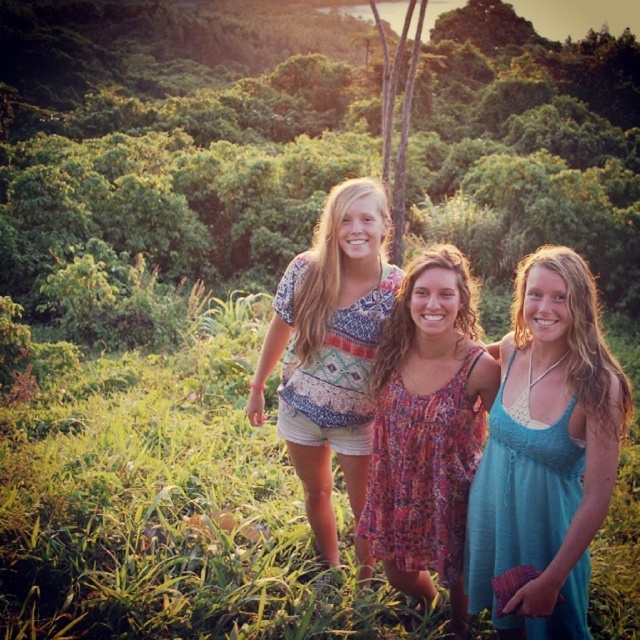
Question: Is blue fabric dress at center to the right of floral dress at center from the viewer's perspective?

Choices:
 (A) yes
 (B) no

Answer: (A)

Question: Among these points, which one is nearest to the camera?

Choices:
 (A) (550, 330)
 (B) (452, 268)

Answer: (A)

Question: Does blue fabric dress at center have a larger size compared to printed cotton shirt at center?

Choices:
 (A) yes
 (B) no

Answer: (B)

Question: Is blue fabric dress at center smaller than printed cotton shirt at center?

Choices:
 (A) yes
 (B) no

Answer: (A)

Question: Which object is positioned farthest from the floral dress at center?

Choices:
 (A) printed cotton shirt at center
 (B) blue fabric dress at center

Answer: (A)

Question: Among these objects, which one is nearest to the camera?

Choices:
 (A) blue fabric dress at center
 (B) floral dress at center
 (C) printed cotton shirt at center

Answer: (A)